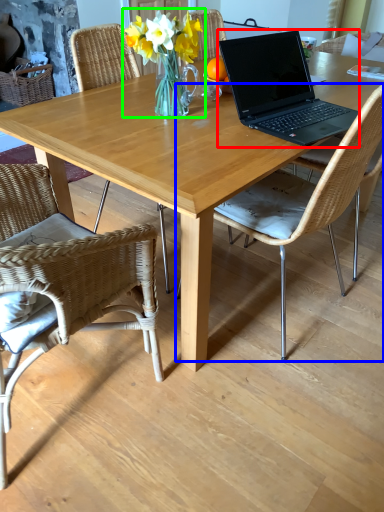
Question: Which object is positioned farthest from laptop (highlighted by a red box)? Select from chair (highlighted by a blue box) and floral arrangement (highlighted by a green box).

Choices:
 (A) chair
 (B) floral arrangement

Answer: (B)